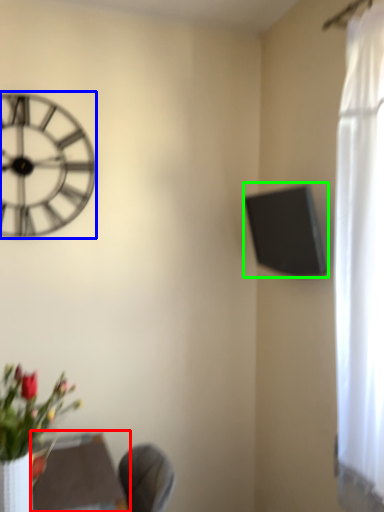
Question: Based on their relative distances, which object is nearer to round table (highlighted by a red box)? Choose from wall clock (highlighted by a blue box) and window screen (highlighted by a green box).

Choices:
 (A) wall clock
 (B) window screen

Answer: (A)